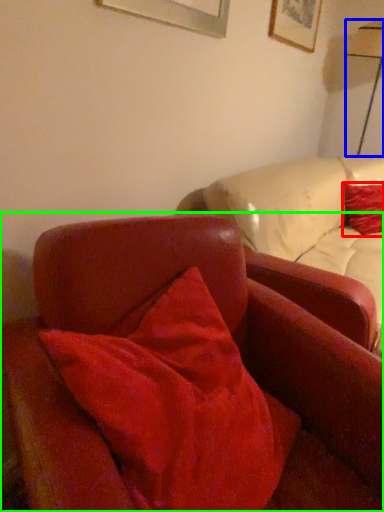
Question: Based on their relative distances, which object is farther from pillow (highlighted by a red box)? Choose from table lamp (highlighted by a blue box) and chair (highlighted by a green box).

Choices:
 (A) table lamp
 (B) chair

Answer: (B)